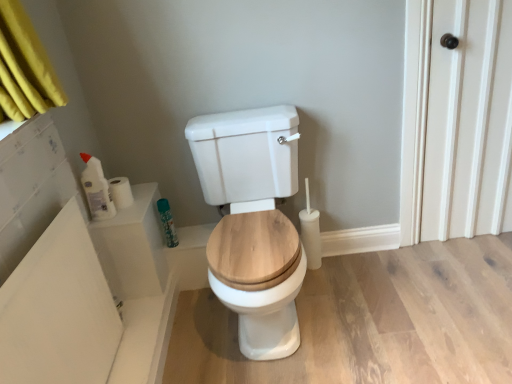
Question: Is white matte toilet paper at upper left wider or thinner than white wood door at right?

Choices:
 (A) thin
 (B) wide

Answer: (A)

Question: Is point (115, 190) closer or farther from the camera than point (444, 182)?

Choices:
 (A) closer
 (B) farther

Answer: (A)

Question: Which object is the closest to the white matte toilet paper at upper left?

Choices:
 (A) white glossy bathtub at upper left
 (B) white glossy toilet at center
 (C) white glossy bottle at left, acting as the 1th toiletry starting from the left
 (D) green matte spray can at upper left, the 2th toiletry when ordered from front to back
 (E) white wood door at right

Answer: (C)

Question: Which of these objects is positioned farthest from the white glossy toilet at center?

Choices:
 (A) white glossy bathtub at upper left
 (B) green matte spray can at upper left, the 2th toiletry when ordered from front to back
 (C) white wood door at right
 (D) white matte toilet paper at upper left
 (E) white glossy bottle at left, the second toiletry in the right-to-left sequence

Answer: (C)